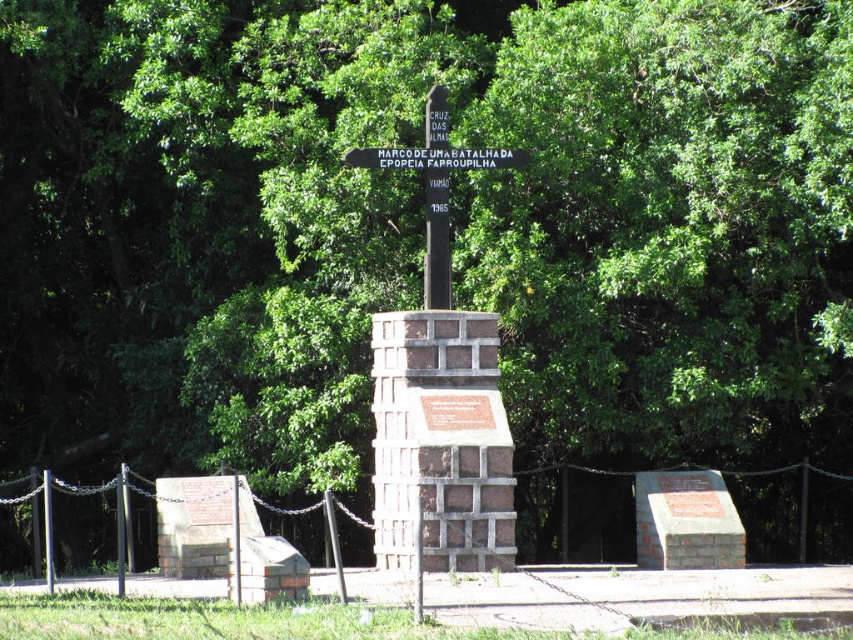
You are standing at the memorial site and want to locate the brown brick monument at center and the black polished wood signpost at center. According to the scene, which one is positioned to the right of the other?

The brown brick monument at center is positioned to the right of the black polished wood signpost at center.

You are a tour guide explaining the memorial site to visitors. You mention the brown brick monument at center and the white plastic sign at center. Which one is wider?

The white plastic sign at center is wider than the brown brick monument at center.

You are a tourist visiting the memorial site and want to take a photo of the brown brick monument at center. You are currently standing at point (438,388). Can you take a clear photo of the monument without any obstructions?

Yes, because the brown brick monument at center is located at point (438,388), so you are already at the monument and can take a clear photo.